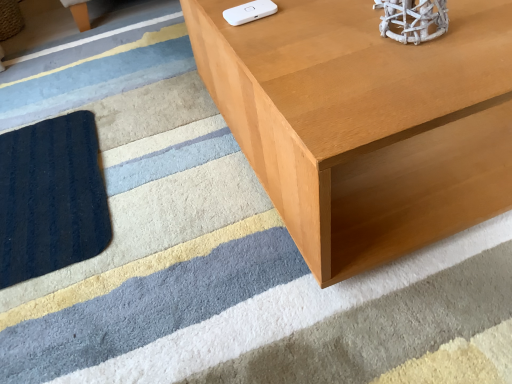
Where is `spots to the right of white matte wii controller at upper center`? Image resolution: width=512 pixels, height=384 pixels. spots to the right of white matte wii controller at upper center is located at coordinates 324,13.